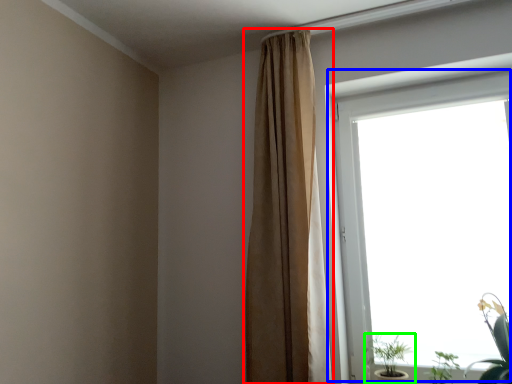
Question: Estimate the real-world distances between objects in this image. Which object is farther from curtain (highlighted by a red box), window (highlighted by a blue box) or houseplant (highlighted by a green box)?

Choices:
 (A) window
 (B) houseplant

Answer: (B)